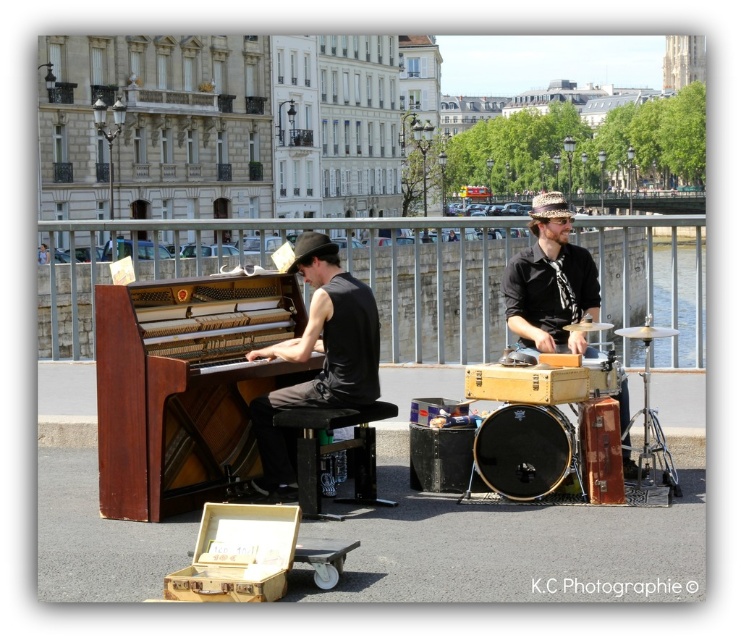
You are standing in the street performance area and want to take a photo. You notice two points marked in the scene. Which point, point (122, 506) or point (296, 442), will appear larger in your camera view because it is closer to the camera?

Point (122, 506) is closer to the camera than point (296, 442), so it will appear larger in the camera view.

You are a photographer standing in front of the scene. You want to take a photo that includes both point [365,307] and point [539,301]. Which point will appear larger in the photo?

Point [365,307] will appear larger in the photo because it is closer to the camera than point [539,301].

Consider the image. You are a street performer who needs to set up your equipment. You have a matte black piano at center and a wooden drum at center. Which one is taller?

The matte black piano at center is much taller than the wooden drum at center.